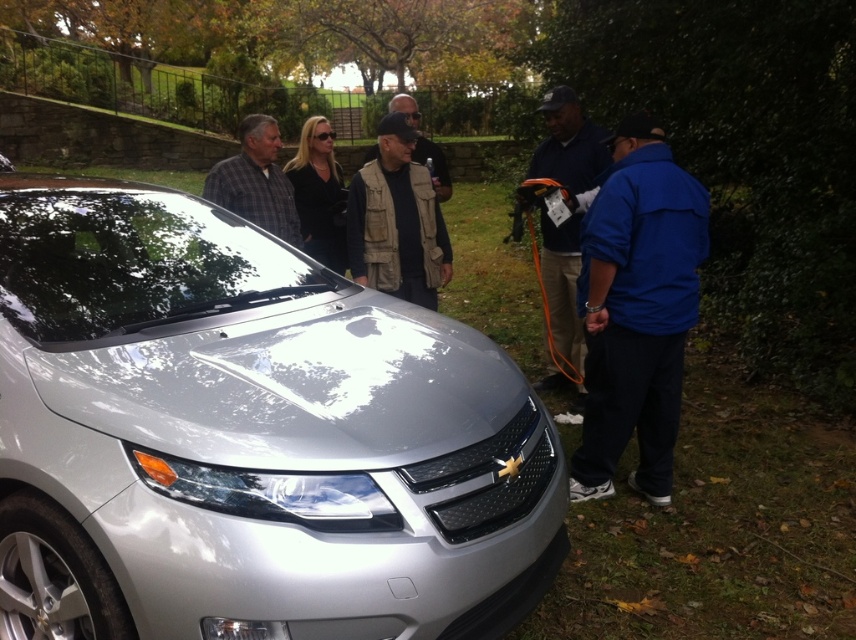
Question: Is plaid fabric shirt at center below khaki fabric vest at center?

Choices:
 (A) no
 (B) yes

Answer: (B)

Question: Which object is the farthest from the plaid fabric shirt at center?

Choices:
 (A) blue fabric jacket at right
 (B) dark blue fabric jacket at right
 (C) khaki fabric vest at center

Answer: (C)

Question: Which object is closer to the camera taking this photo?

Choices:
 (A) plaid fabric shirt at center
 (B) dark blue fabric jacket at right
 (C) blue fabric jacket at right

Answer: (C)

Question: Which point is farther to the camera?

Choices:
 (A) khaki fabric vest at center
 (B) sleek silver car at center
 (C) khaki vest at center

Answer: (A)

Question: In this image, where is khaki vest at center located relative to dark blue fabric jacket at right?

Choices:
 (A) right
 (B) left

Answer: (B)

Question: Can you confirm if khaki vest at center is positioned above dark blue fabric jacket at right?

Choices:
 (A) yes
 (B) no

Answer: (A)